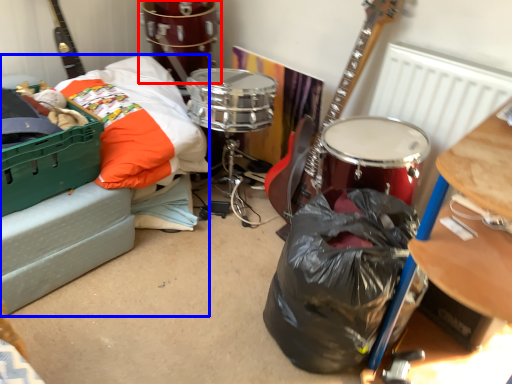
Question: Which object appears closest to the camera in this image, drum (highlighted by a red box) or couch (highlighted by a blue box)?

Choices:
 (A) drum
 (B) couch

Answer: (B)